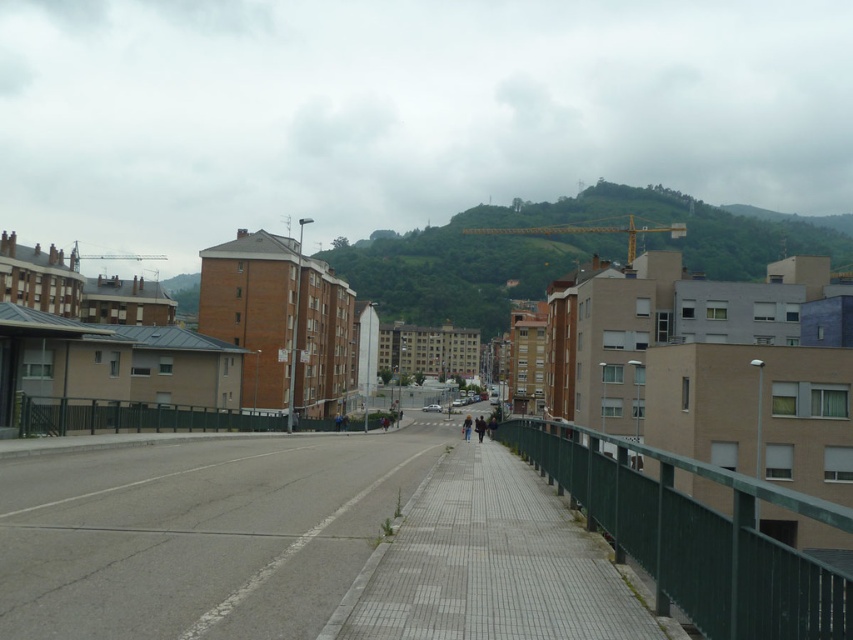
Question: Estimate the real-world distances between objects in this image. Which object is farther from the dark blue jacket at center?

Choices:
 (A) gray concrete sidewalk at center
 (B) dark blue jeans at center
 (C) gray concrete pavement at center

Answer: (C)

Question: Which of these objects is positioned farthest from the dark blue jacket at center?

Choices:
 (A) gray concrete pavement at center
 (B) gray concrete sidewalk at center

Answer: (A)

Question: Which object appears closest to the camera in this image?

Choices:
 (A) dark blue jacket at center
 (B) dark blue jeans at center

Answer: (B)

Question: Can you confirm if gray concrete pavement at center is positioned to the left of dark blue jacket at center?

Choices:
 (A) no
 (B) yes

Answer: (B)

Question: Is green grassy hill at center thinner than dark blue jacket at center?

Choices:
 (A) no
 (B) yes

Answer: (A)

Question: In this image, where is green grassy hill at center located relative to dark blue jeans at center?

Choices:
 (A) below
 (B) above

Answer: (B)